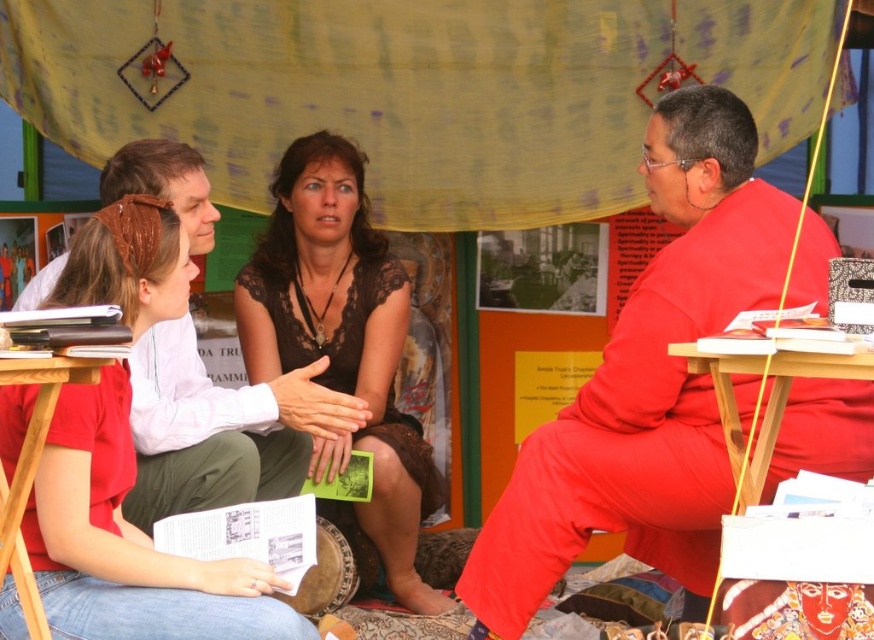
Question: Which point is closer to the camera?

Choices:
 (A) (688, 486)
 (B) (162, 515)
 (C) (392, 292)

Answer: (A)

Question: Which of the following is the closest to the observer?

Choices:
 (A) black lace dress at center
 (B) matte white shirt at center

Answer: (B)

Question: Can you confirm if matte red robe at center is smaller than black lace dress at center?

Choices:
 (A) yes
 (B) no

Answer: (B)

Question: Does matte red robe at center appear under black lace dress at center?

Choices:
 (A) yes
 (B) no

Answer: (A)

Question: Estimate the real-world distances between objects in this image. Which object is farther from the matte red robe at center?

Choices:
 (A) black lace dress at center
 (B) matte white shirt at center

Answer: (A)

Question: Does matte red robe at center have a greater width compared to matte white shirt at center?

Choices:
 (A) no
 (B) yes

Answer: (B)